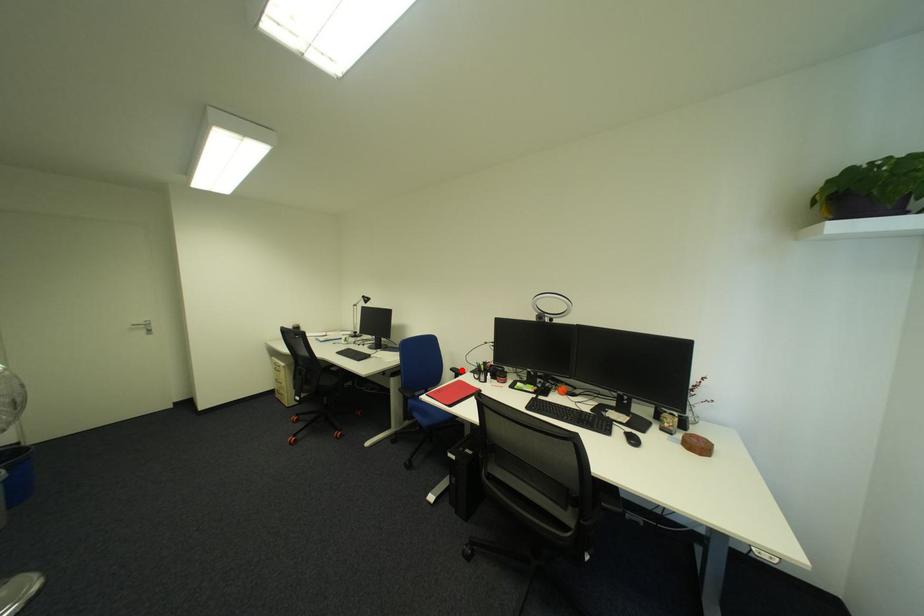
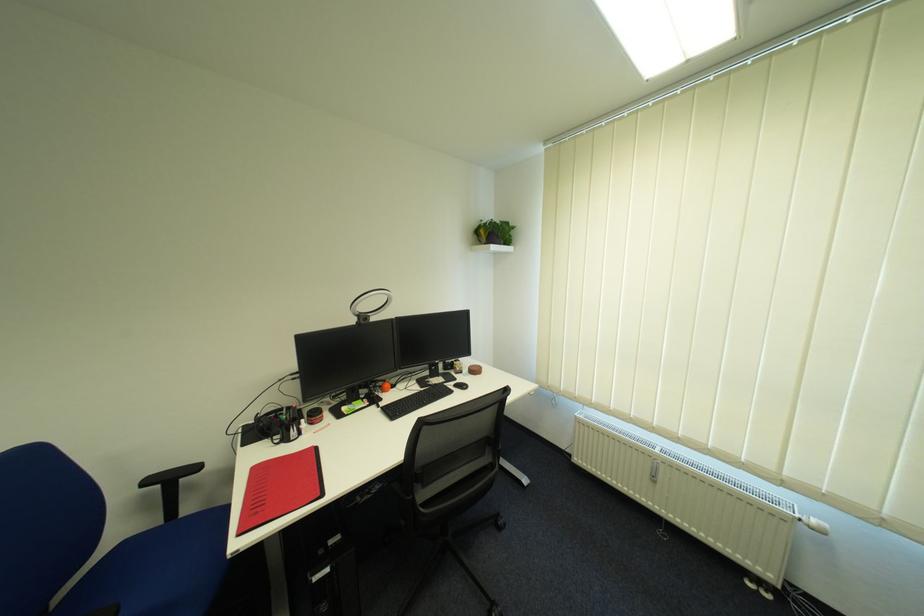
Find the pixel in the second image that matches the highlighted location in the first image.

(157, 483)